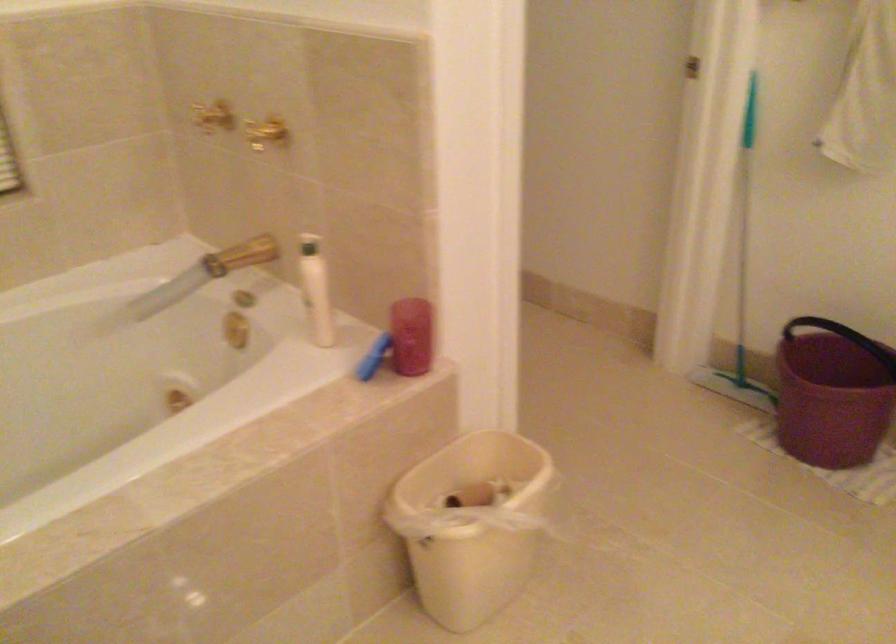
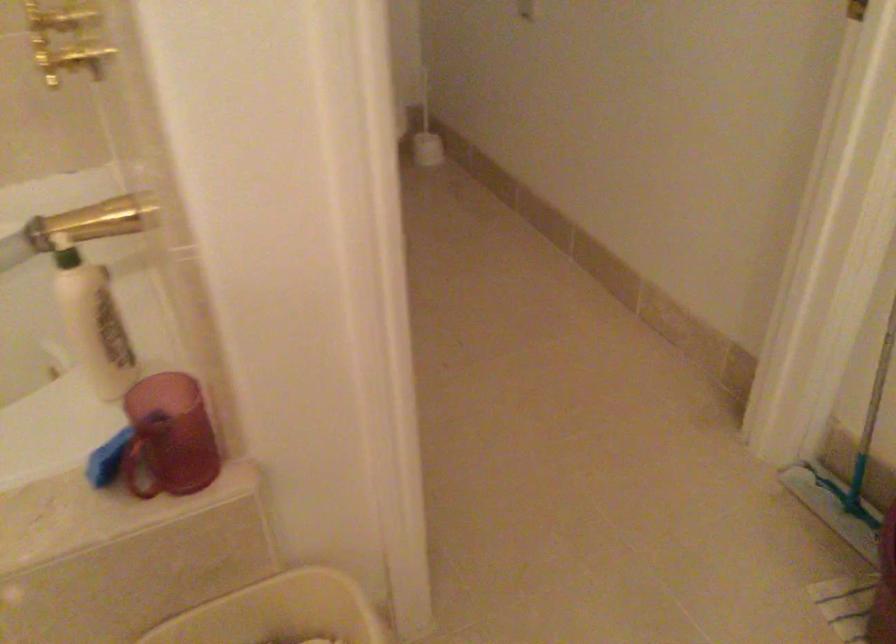
Where in the second image is the point corresponding to point 372,372 from the first image?

(140, 462)